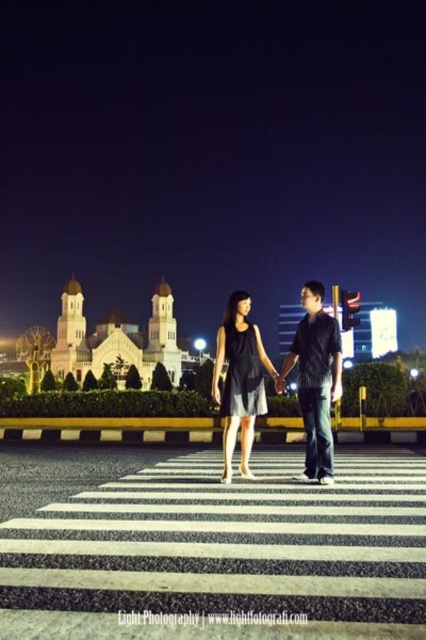
Question: Can you confirm if dark blue jeans at center is thinner than matte black dress at center?

Choices:
 (A) no
 (B) yes

Answer: (B)

Question: Which point appears closest to the camera in this image?

Choices:
 (A) (227, 403)
 (B) (311, 342)

Answer: (A)

Question: Where is dark blue jeans at center located in relation to matte black dress at center in the image?

Choices:
 (A) below
 (B) above

Answer: (A)

Question: Is dark blue jeans at center thinner than matte black dress at center?

Choices:
 (A) yes
 (B) no

Answer: (A)